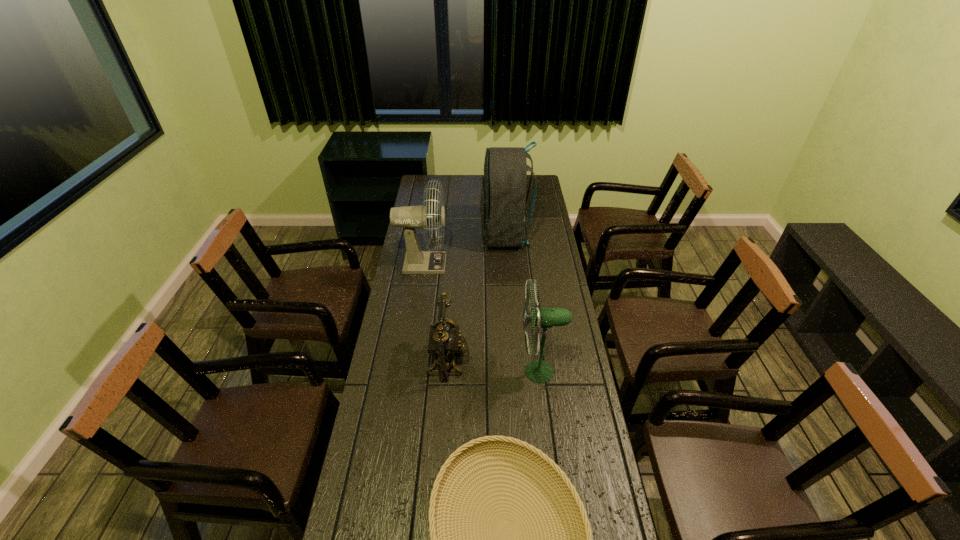
Locate an element on the screen. This screenshot has width=960, height=540. backpack is located at coordinates (503, 200).

Locate an element on the screen. The height and width of the screenshot is (540, 960). the left fan is located at coordinates (416, 261).

You are a GUI agent. You are given a task and a screenshot of the screen. Output one action in this format:
    pyautogui.click(x=<x>, y=<y>)
    Task: Click on the right fan
    This screenshot has width=960, height=540.
    Given the screenshot: What is the action you would take?
    pyautogui.click(x=539, y=371)

At what (x,y) coordinates should I click in order to perform the action: click on telephone. Please return your answer as a coordinate pair (x, y). This screenshot has height=540, width=960. Looking at the image, I should click on (445, 342).

Identify the location of vacant space located 0.070m on the front-facing side of the backpack. The width and height of the screenshot is (960, 540). (466, 235).

Find the location of a particular element. This screenshot has width=960, height=540. free location located on the front-facing side of the backpack is located at coordinates (434, 235).

Locate an element on the screen. free space located 0.370m on the front-facing side of the backpack is located at coordinates point(405,235).

Locate an element on the screen. vacant space located 0.080m on the air flow direction of the left fan is located at coordinates (465, 264).

The width and height of the screenshot is (960, 540). I want to click on vacant space located on the front-facing side of the nearer fan, so click(466, 372).

Locate an element on the screen. Image resolution: width=960 pixels, height=540 pixels. free location located 0.400m on the front-facing side of the nearer fan is located at coordinates (406, 372).